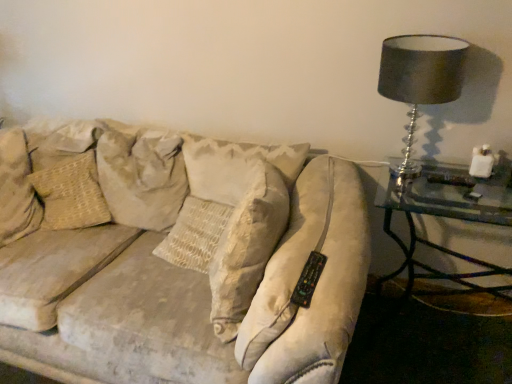
Question: Is point (453, 96) positioned closer to the camera than point (167, 226)?

Choices:
 (A) farther
 (B) closer

Answer: (B)

Question: Considering their positions, is matte black lampshade at upper right located in front of or behind beige fabric pillow at upper left, which is counted as the 1th pillow, starting from the right?

Choices:
 (A) front
 (B) behind

Answer: (A)

Question: Estimate the real-world distances between objects in this image. Which object is farther from the beige textured pillow at left, which ranks as the 1th pillow in left-to-right order?

Choices:
 (A) beige fabric pillow at upper left, the second pillow from the left
 (B) clear glass table at right
 (C) matte black lampshade at upper right

Answer: (B)

Question: Based on their relative distances, which object is nearer to the beige textured pillow at left, the second pillow when ordered from right to left?

Choices:
 (A) clear glass table at right
 (B) matte black lampshade at upper right
 (C) beige fabric pillow at upper left, the second pillow from the left

Answer: (C)